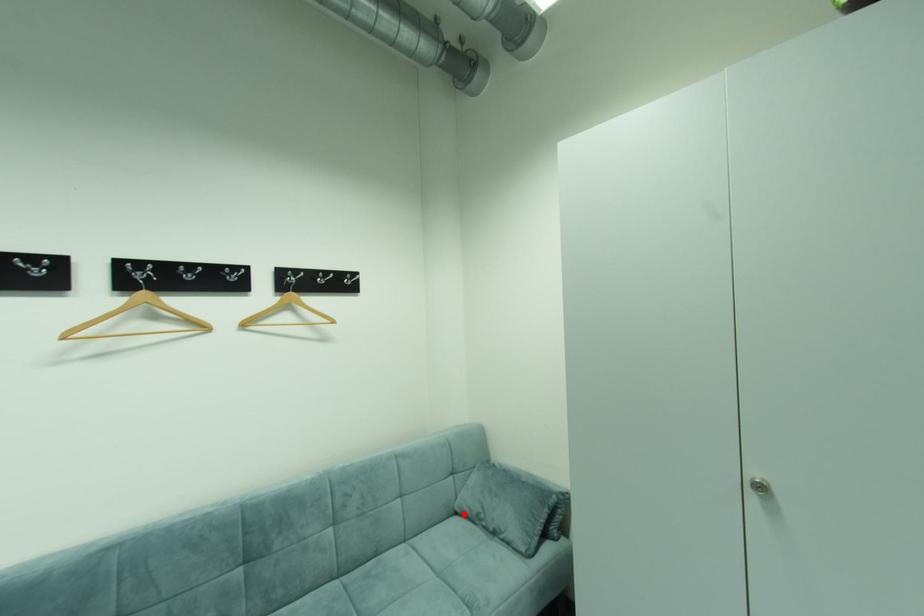
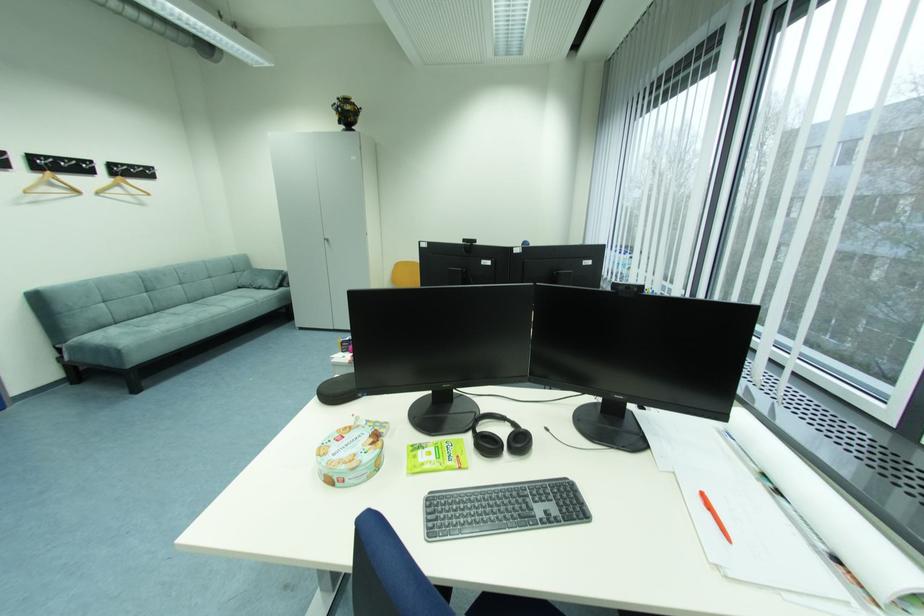
Locate, in the second image, the point that corresponds to the highlighted location in the first image.

(246, 288)